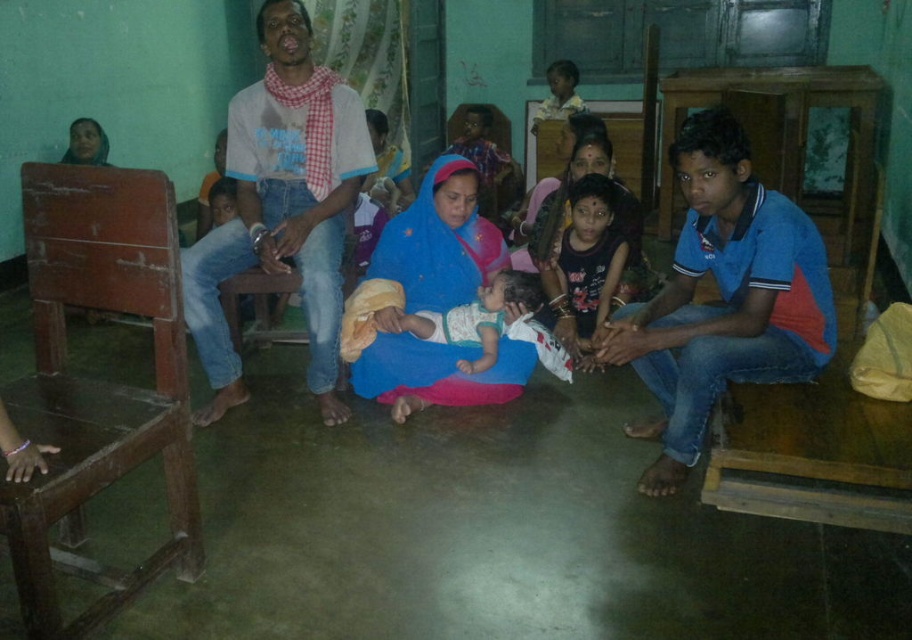
Describe the element at coordinates (723, 298) in the screenshot. I see `blue cotton shirt at right` at that location.

You are a GUI agent. You are given a task and a screenshot of the screen. Output one action in this format:
    pyautogui.click(x=<x>, y=<y>)
    Task: Click on the blue cotton shirt at right
    The image size is (912, 640).
    Given the screenshot: What is the action you would take?
    pyautogui.click(x=723, y=298)

Is white cotton shirt at center below light brown wooden chair at upper center?

Correct, white cotton shirt at center is located below light brown wooden chair at upper center.

Can you confirm if white cotton shirt at center is bigger than light brown wooden chair at upper center?

Indeed, white cotton shirt at center has a larger size compared to light brown wooden chair at upper center.

In order to click on white cotton shirt at center in this screenshot , I will do `click(282, 205)`.

Is wooden chair at left to the right of blue fabric at center from the viewer's perspective?

In fact, wooden chair at left is to the left of blue fabric at center.

Looking at this image, does wooden chair at left have a smaller size compared to blue fabric at center?

Incorrect, wooden chair at left is not smaller in size than blue fabric at center.

This screenshot has height=640, width=912. Find the location of `wooden chair at left`. wooden chair at left is located at coordinates (98, 381).